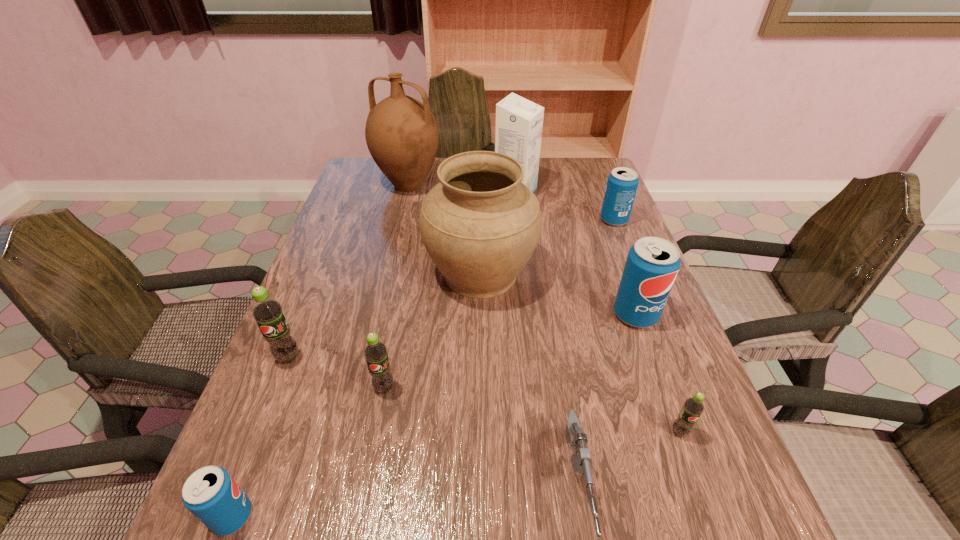
Where is `the eighth nearest object`? This screenshot has width=960, height=540. the eighth nearest object is located at coordinates (622, 184).

Image resolution: width=960 pixels, height=540 pixels. I want to click on the second biggest blue soda can, so click(622, 184).

The width and height of the screenshot is (960, 540). I want to click on the nearest green soda, so click(x=693, y=407).

Where is `the smallest green soda`? Image resolution: width=960 pixels, height=540 pixels. the smallest green soda is located at coordinates click(693, 407).

The height and width of the screenshot is (540, 960). I want to click on the nearest soda can, so click(x=211, y=494).

In order to click on the smallest blue soda can in this screenshot , I will do `click(211, 494)`.

Image resolution: width=960 pixels, height=540 pixels. Find the location of `blank area located 0.330m on the right of the tallest object`. blank area located 0.330m on the right of the tallest object is located at coordinates (543, 185).

This screenshot has height=540, width=960. In order to click on vacant area situated 0.070m on the back of the carton in this screenshot , I will do `click(514, 170)`.

Find the location of a particular element. The image size is (960, 540). vacant space located 0.130m on the left of the urn is located at coordinates (373, 273).

The image size is (960, 540). I want to click on free space located on the left of the second nearest blue soda can, so click(x=543, y=315).